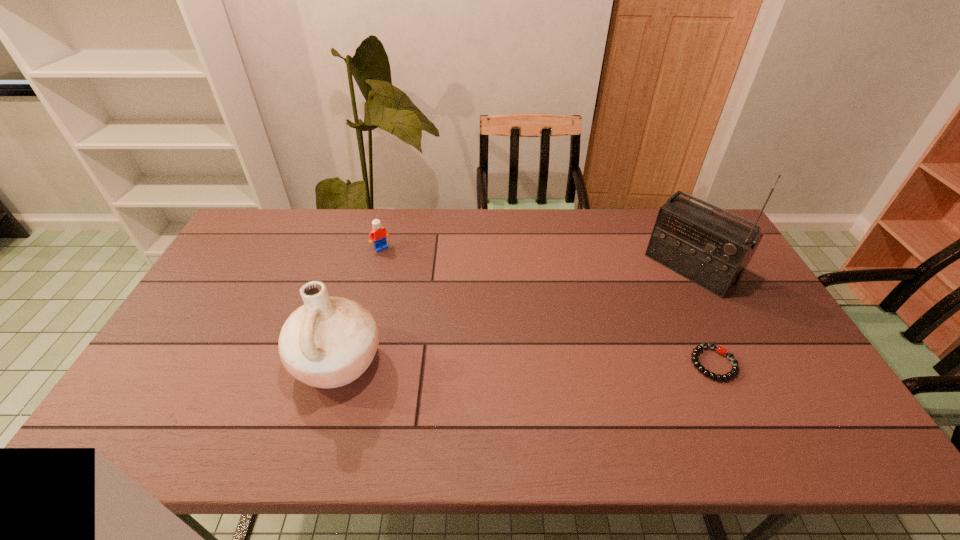
Where is `free space on the desktop that is between the third shortest object and the shortest object and is positioned on the face of the Lego`? This screenshot has height=540, width=960. free space on the desktop that is between the third shortest object and the shortest object and is positioned on the face of the Lego is located at coordinates (486, 363).

The height and width of the screenshot is (540, 960). In order to click on vacant space on the desktop that is between the third shortest object and the bracelet and is positioned on the front panel of the tallest object in this screenshot , I will do `click(580, 363)`.